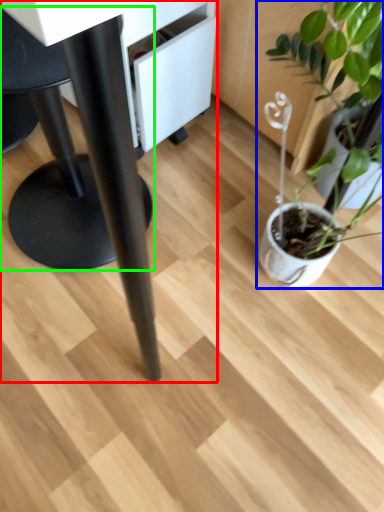
Question: Considering the real-world distances, which object is closest to table (highlighted by a red box)? houseplant (highlighted by a blue box) or swivel chair (highlighted by a green box).

Choices:
 (A) houseplant
 (B) swivel chair

Answer: (B)